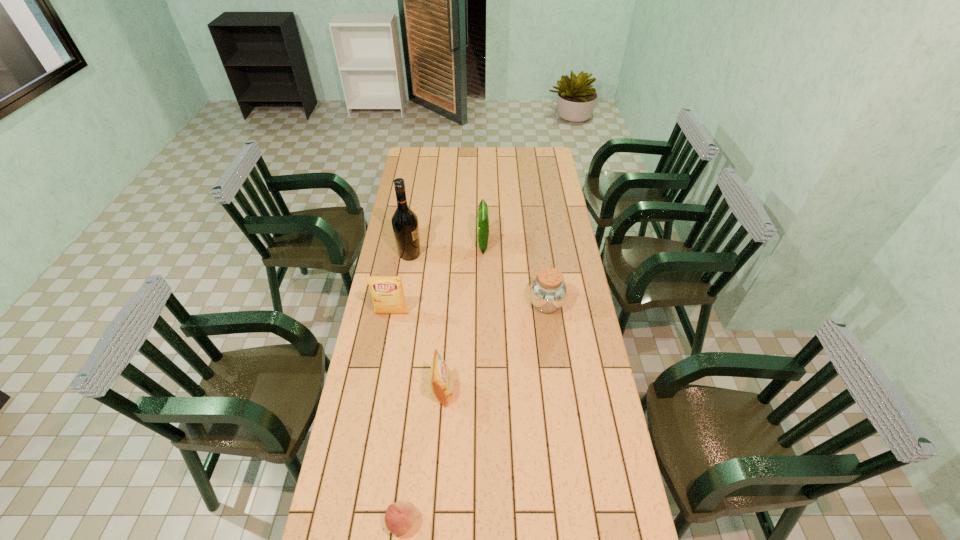
Locate an element on the screen. vacant space located 0.400m on the front of the leftmost crisp (potato chip) with the logo is located at coordinates (374, 410).

The height and width of the screenshot is (540, 960). Identify the location of vacant area situated 0.140m on the front-facing side of the farthest crisp (potato chip). (447, 244).

At what (x,y) coordinates should I click in order to perform the action: click on vacant space positioned on the front-facing side of the farthest crisp (potato chip). Please return your answer as a coordinate pair (x, y). This screenshot has height=540, width=960. Looking at the image, I should click on (460, 244).

Identify the location of vacant space situated 0.070m on the front-facing side of the farthest crisp (potato chip). The height and width of the screenshot is (540, 960). (463, 244).

Find the location of a particular element. This screenshot has height=540, width=960. vacant region located 0.340m on the front-facing side of the second nearest object is located at coordinates (551, 392).

The image size is (960, 540). Identify the location of free region located on the left of the jar. (455, 304).

Where is `vacant point located 0.110m on the back of the fourth object from right to left`? The width and height of the screenshot is (960, 540). vacant point located 0.110m on the back of the fourth object from right to left is located at coordinates (408, 468).

The height and width of the screenshot is (540, 960). I want to click on wine bottle that is at the left edge, so click(405, 225).

This screenshot has width=960, height=540. I want to click on crisp (potato chip) located in the left edge section of the desktop, so click(387, 292).

Where is `object that is at the right edge`? The height and width of the screenshot is (540, 960). object that is at the right edge is located at coordinates (548, 292).